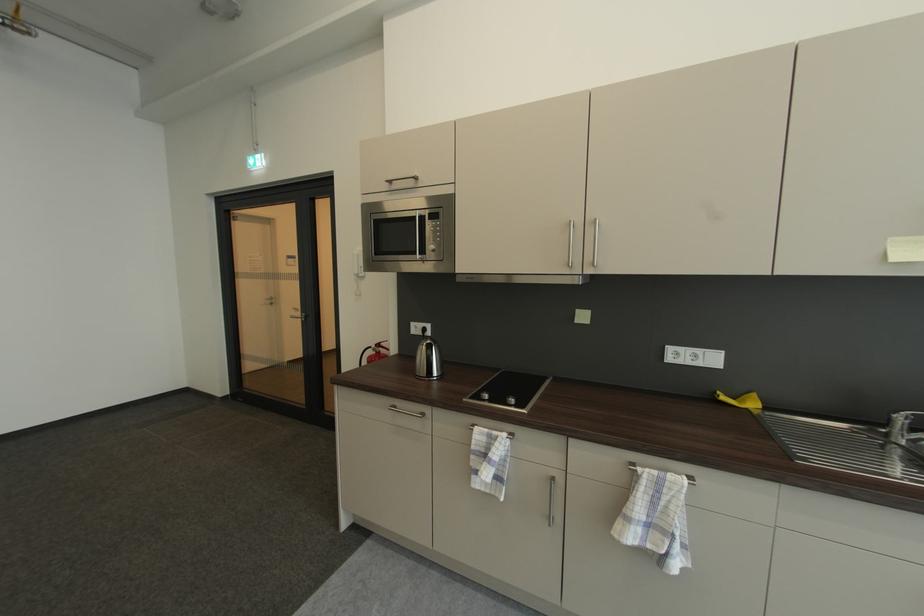
Where would you turn the microwave control dial? Please return your answer as a coordinate pair (x, y).

(434, 228)